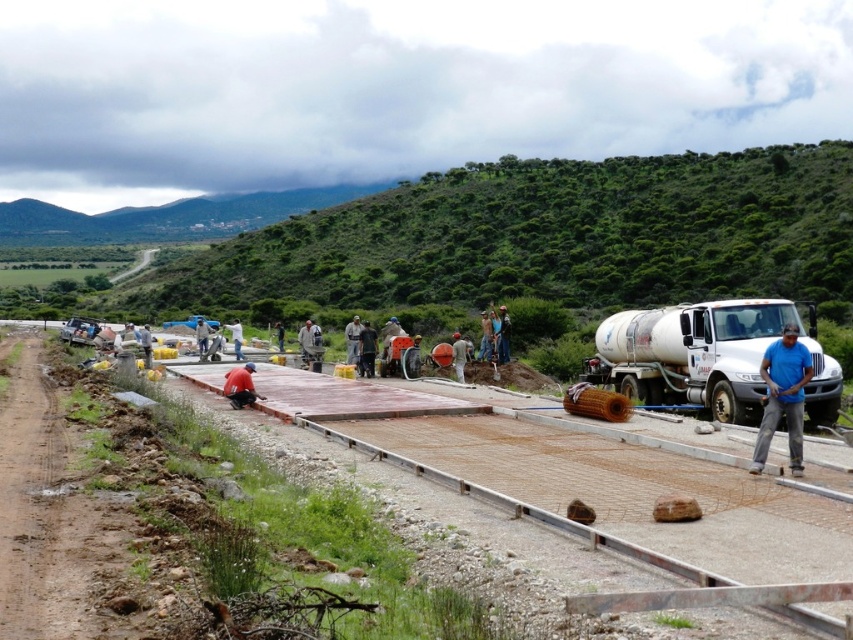
Between smooth concrete slab at center and blue shirt at center, which one has less height?

smooth concrete slab at center

Between point (589, 532) and point (233, 340), which one is positioned in front?

Point (589, 532) is in front.

The image size is (853, 640). In order to click on smooth concrete slab at center in this screenshot , I will do `click(456, 448)`.

How much distance is there between white metallic tanker truck at right and blue shirt at center?

The distance of white metallic tanker truck at right from blue shirt at center is 96.43 feet.

Can you confirm if white metallic tanker truck at right is positioned to the left of blue shirt at center?

Incorrect, white metallic tanker truck at right is not on the left side of blue shirt at center.

Locate an element on the screen. white metallic tanker truck at right is located at coordinates (706, 356).

Identify the location of white metallic tanker truck at right. (706, 356).

Consider the image. Between smooth concrete slab at center and blue fabric construction worker at center, which one has more height?

With more height is blue fabric construction worker at center.

Between point (824, 627) and point (782, 385), which one is positioned in front?

Point (824, 627) is more forward.

This screenshot has height=640, width=853. What are the coordinates of `smooth concrete slab at center` in the screenshot? It's located at (456, 448).